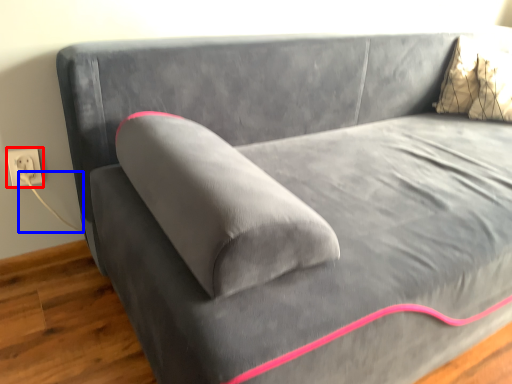
Question: Which of the following is the farthest to the observer, electric outlet (highlighted by a red box) or string (highlighted by a blue box)?

Choices:
 (A) electric outlet
 (B) string

Answer: (A)